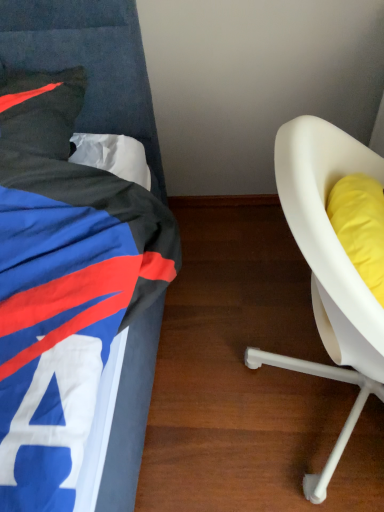
Question: Should I look upward or downward to see white plastic chair at right?

Choices:
 (A) up
 (B) down

Answer: (B)